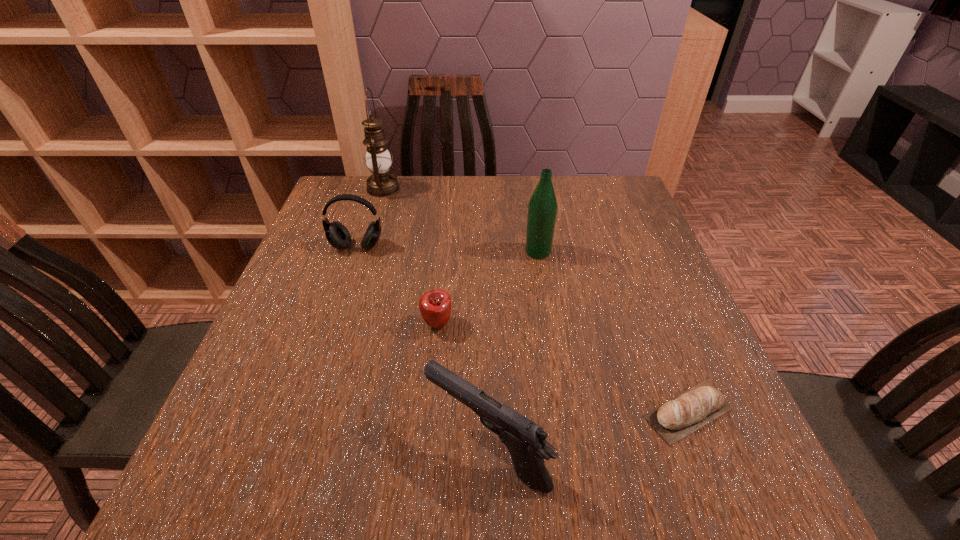
Locate which object ranks second in proximity to the gun. Please provide its 2D coordinates. Your answer should be formatted as a tuple, i.e. [(x, y)], where the tuple contains the x and y coordinates of a point satisfying the conditions above.

[(675, 419)]

Where is `free space that satisfies the following two spatial constraints: 1. on the ear cups of the headset; 2. on the left side of the second tallest object`? The height and width of the screenshot is (540, 960). free space that satisfies the following two spatial constraints: 1. on the ear cups of the headset; 2. on the left side of the second tallest object is located at coordinates (355, 252).

Where is `free spot that satisfies the following two spatial constraints: 1. on the ear cups of the second object from right to left; 2. on the left side of the headset`? The image size is (960, 540). free spot that satisfies the following two spatial constraints: 1. on the ear cups of the second object from right to left; 2. on the left side of the headset is located at coordinates (355, 252).

Locate an element on the screen. Image resolution: width=960 pixels, height=540 pixels. vacant region that satisfies the following two spatial constraints: 1. on the front side of the farthest object; 2. on the left side of the bottle is located at coordinates (364, 252).

This screenshot has width=960, height=540. What are the coordinates of `free space that satisfies the following two spatial constraints: 1. on the back side of the apple; 2. on the left side of the fifth object from left to right` in the screenshot? It's located at (444, 252).

The image size is (960, 540). I want to click on free space that satisfies the following two spatial constraints: 1. on the ear cups of the shortest object; 2. on the left side of the headset, so click(x=302, y=411).